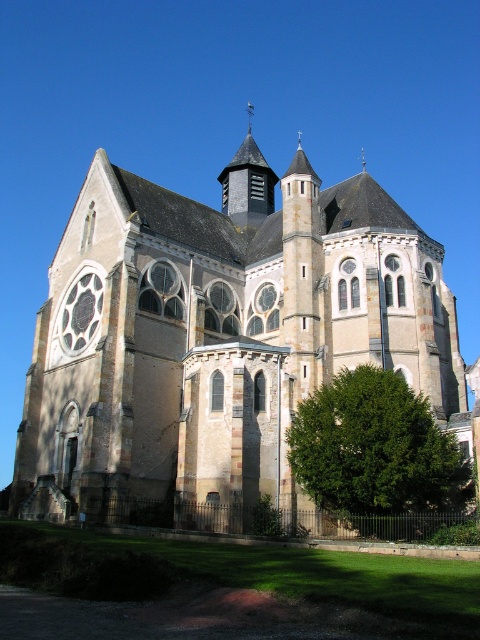
Question: Can you confirm if stone church at center is positioned to the left of green leafy tree at lower right?

Choices:
 (A) yes
 (B) no

Answer: (A)

Question: Is stone church at center positioned before green leafy tree at lower right?

Choices:
 (A) no
 (B) yes

Answer: (A)

Question: Which point is farther to the camera?

Choices:
 (A) stone church at center
 (B) green leafy tree at lower right

Answer: (A)

Question: Which object appears closest to the camera in this image?

Choices:
 (A) stone church at center
 (B) green leafy tree at lower right

Answer: (B)

Question: Does stone church at center appear under green leafy tree at lower right?

Choices:
 (A) yes
 (B) no

Answer: (B)

Question: Which of the following is the closest to the observer?

Choices:
 (A) stone church at center
 (B) green leafy tree at lower right

Answer: (B)